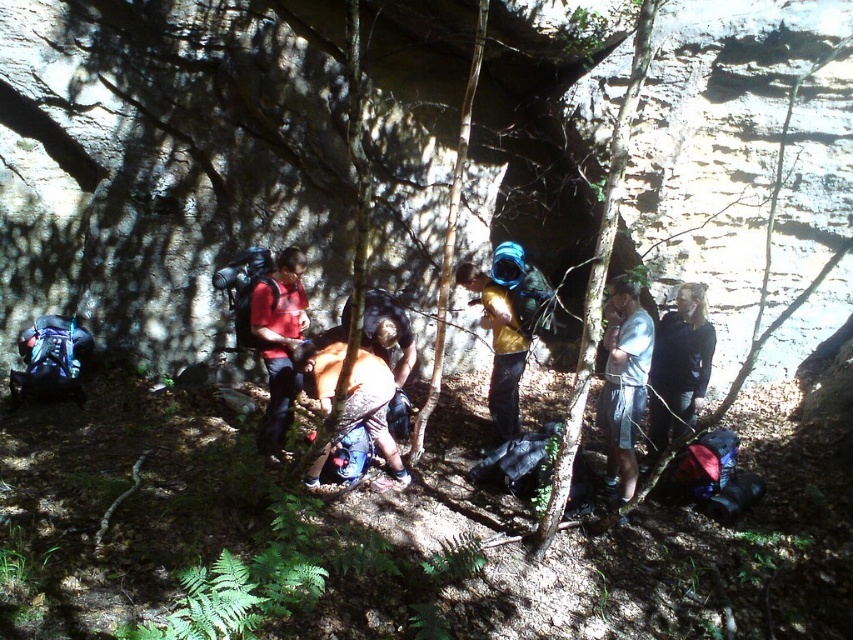
In the forest scene with people, where is the light blue denim shorts at center located in relation to the brown fabric backpack at center?

The light blue denim shorts at center is to the right of the brown fabric backpack at center.

Looking at this image, you are a hiker trying to reach a water bottle located at the center of the scene. You currently have the light blue denim shorts at center and the brown fabric backpack at center in your view. How far apart are these two items from each other?

The light blue denim shorts at center and brown fabric backpack at center are 5.86 feet apart.